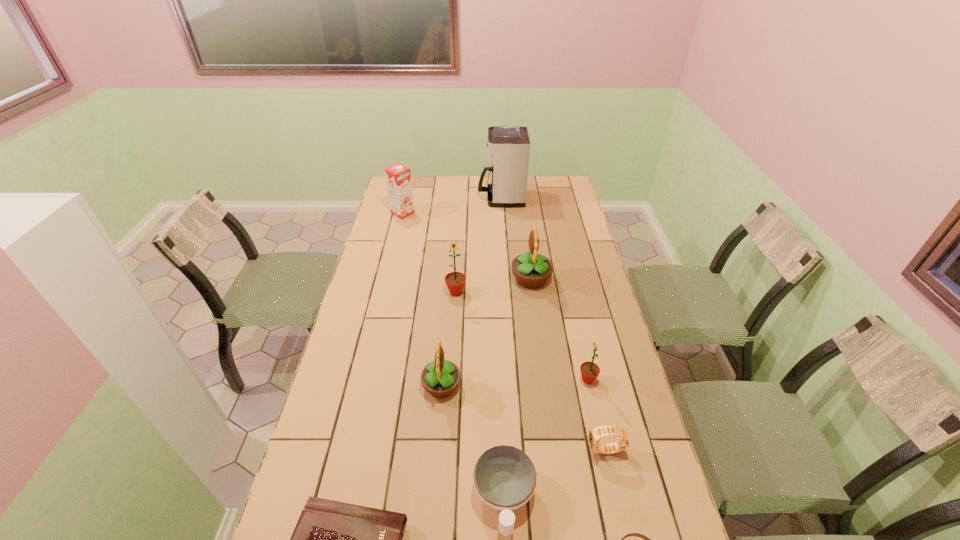
Identify the location of sunflower that stands as the closest to the shortest object. (589, 371).

This screenshot has width=960, height=540. Identify the location of sunflower object that ranks as the closest to the farther yellow sunflower. (455, 281).